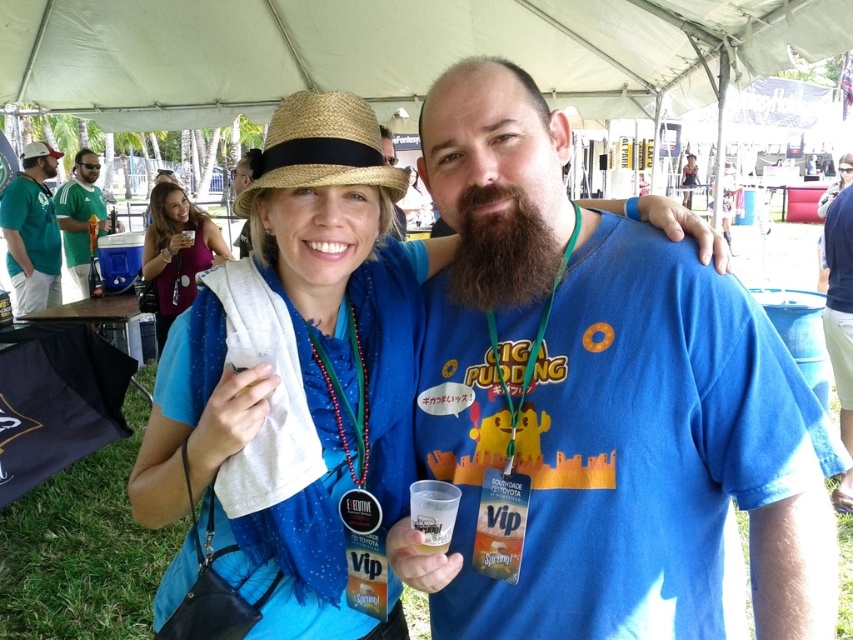
Looking at this image, you are organizing a clothing donation drive and need to categorize items by size. You have a blue cotton shirt at center and a matte purple dress at upper left. Which item should you place in the small size bin?

The blue cotton shirt at center has a smaller size compared to matte purple dress at upper left, so it should be placed in the small size bin.

You are at an outdoor event and see two people in front of you. One has a dark brown thick beard at center and the other is wearing a green jersey at left. Which person is positioned lower in the image?

The dark brown thick beard at center is positioned below the green jersey at left, so the person with the dark brown thick beard at center is lower in the image.